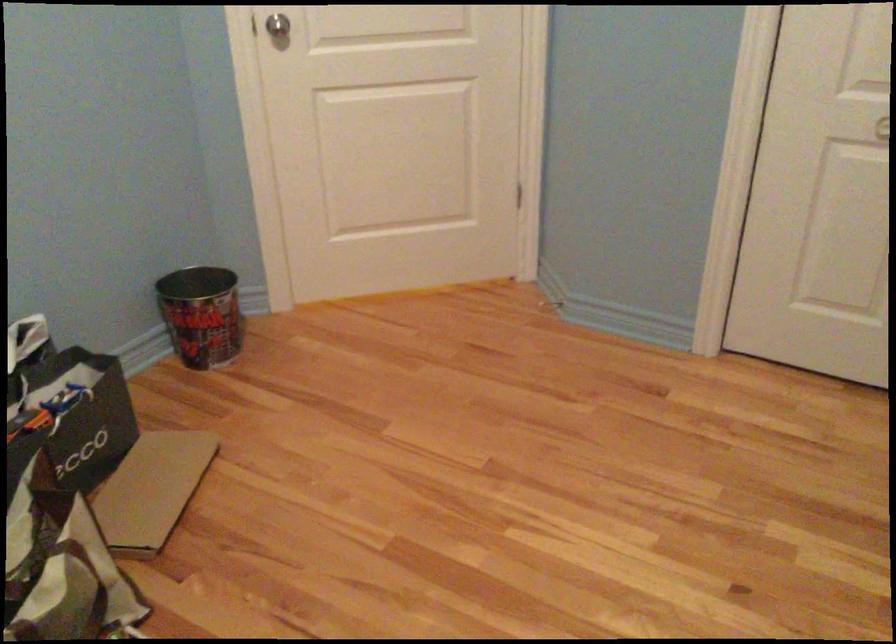
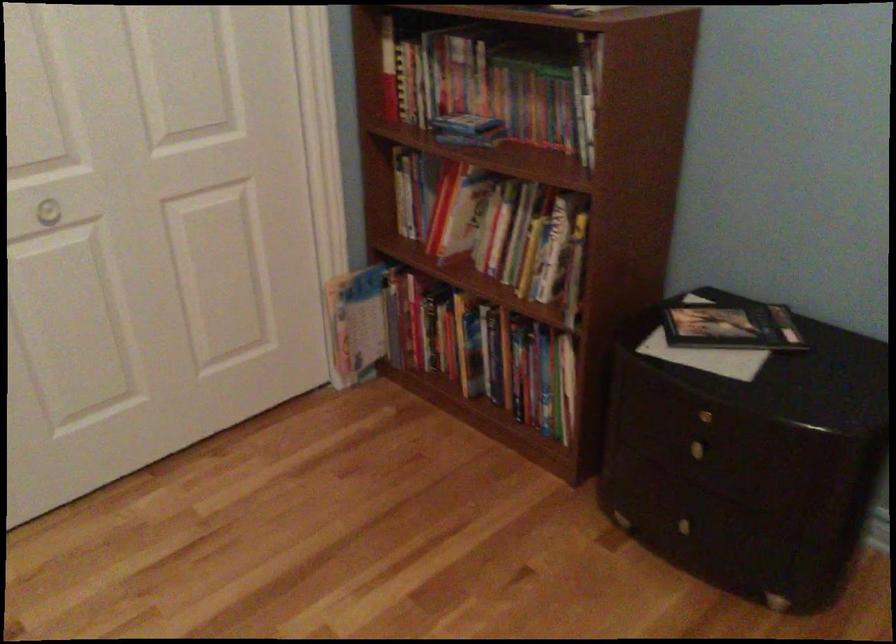
How did the camera likely rotate?

The camera's rotation is toward right-down.